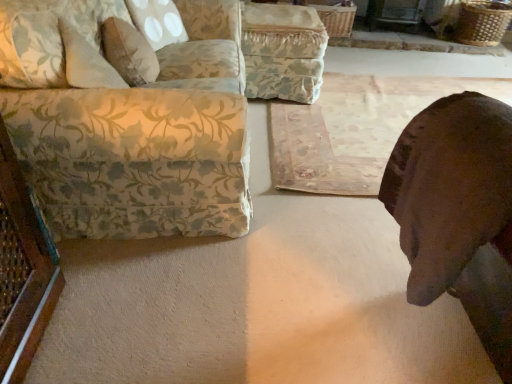
The width and height of the screenshot is (512, 384). Identify the location of brown leather dog at lower right. (451, 189).

Where is `rustic wooden mat at center`? This screenshot has height=384, width=512. rustic wooden mat at center is located at coordinates (355, 129).

What do you see at coordinates (283, 51) in the screenshot?
I see `floral fabric ottoman at center` at bounding box center [283, 51].

This screenshot has width=512, height=384. What do you see at coordinates (128, 117) in the screenshot?
I see `floral fabric couch at left` at bounding box center [128, 117].

Identify the location of brown leather dog at lower right. Image resolution: width=512 pixels, height=384 pixels. (451, 189).

Which object is positioned more to the right, fluffy beige pillow at upper left or floral fabric couch at left?

floral fabric couch at left is more to the right.

Considering the points (106, 48) and (165, 59), which point is behind, point (106, 48) or point (165, 59)?

The point (165, 59) is more distant.

Is fluffy beige pillow at upper left surrounding floral fabric couch at left?

Actually, floral fabric couch at left is outside fluffy beige pillow at upper left.

Could you tell me if fluffy beige pillow at upper left is facing floral fabric couch at left?

Yes, fluffy beige pillow at upper left is aimed at floral fabric couch at left.

Is brown leather dog at lower right looking in the opposite direction of rustic wooden mat at center?

No, brown leather dog at lower right is not facing away from rustic wooden mat at center.

Is brown leather dog at lower right positioned behind rustic wooden mat at center?

No, the depth of brown leather dog at lower right is less than that of rustic wooden mat at center.

Is brown leather dog at lower right next to rustic wooden mat at center?

brown leather dog at lower right and rustic wooden mat at center are clearly separated.

Which object is positioned more to the left, rustic wooden mat at center or floral fabric ottoman at center?

floral fabric ottoman at center.

Is point (370, 149) farther from viewer compared to point (268, 16)?

No, it is not.

From a real-world perspective, who is located higher, rustic wooden mat at center or floral fabric ottoman at center?

floral fabric ottoman at center, from a real-world perspective.

How many degrees apart are the facing directions of rustic wooden mat at center and floral fabric ottoman at center?

The facing directions of rustic wooden mat at center and floral fabric ottoman at center are 91 degrees apart.

Would you say fluffy beige pillow at upper left is outside floral fabric ottoman at center?

Yes, fluffy beige pillow at upper left is located beyond the bounds of floral fabric ottoman at center.

Between fluffy beige pillow at upper left and floral fabric ottoman at center, which one has smaller width?

fluffy beige pillow at upper left.

In terms of height, does fluffy beige pillow at upper left look taller or shorter compared to floral fabric ottoman at center?

Considering their sizes, fluffy beige pillow at upper left has less height than floral fabric ottoman at center.

From the image's perspective, between fluffy beige pillow at upper left and floral fabric ottoman at center, who is located below?

fluffy beige pillow at upper left, from the image's perspective.

Is brown leather dog at lower right positioned with its back to floral fabric couch at left?

That's not correct — brown leather dog at lower right is not looking away from floral fabric couch at left.

Considering the positions of point (509, 225) and point (208, 11), is point (509, 225) closer or farther from the camera than point (208, 11)?

Clearly, point (509, 225) is closer to the camera than point (208, 11).

Is floral fabric couch at left surrounded by brown leather dog at lower right?

No, floral fabric couch at left is not a part of brown leather dog at lower right.

From a real-world perspective, who is located higher, brown leather dog at lower right or floral fabric couch at left?

brown leather dog at lower right.

From a real-world perspective, which object stands above the other?

brown leather dog at lower right.

The width and height of the screenshot is (512, 384). Find the location of `animal in front of the rustic wooden mat at center`. animal in front of the rustic wooden mat at center is located at coordinates 451,189.

Is point (359, 140) closer to camera compared to point (473, 100)?

No, (359, 140) is further to viewer.

Are rustic wooden mat at center and brown leather dog at lower right making contact?

No, rustic wooden mat at center is not next to brown leather dog at lower right.

Looking at this image, can you confirm if floral fabric ottoman at center is shorter than brown leather dog at lower right?

Yes.

Are floral fabric ottoman at center and brown leather dog at lower right far apart?

Absolutely, floral fabric ottoman at center is distant from brown leather dog at lower right.

Where is `studio couch on the right side of fluffy beige pillow at upper left`? Image resolution: width=512 pixels, height=384 pixels. studio couch on the right side of fluffy beige pillow at upper left is located at coordinates (128, 117).

Image resolution: width=512 pixels, height=384 pixels. Find the location of `mat that is under the brown leather dog at lower right (from a real-world perspective)`. mat that is under the brown leather dog at lower right (from a real-world perspective) is located at coordinates [355, 129].

Considering their positions, is fluffy beige pillow at upper left positioned further to rustic wooden mat at center than floral fabric ottoman at center?

The object further to rustic wooden mat at center is fluffy beige pillow at upper left.

Which object lies nearer to the anchor point floral fabric couch at left, brown leather dog at lower right or floral fabric ottoman at center?

brown leather dog at lower right lies closer to floral fabric couch at left than the other object.

Based on their spatial positions, is brown leather dog at lower right or floral fabric couch at left closer to fluffy beige pillow at upper left?

floral fabric couch at left is positioned closer to the anchor fluffy beige pillow at upper left.

From the image, which object appears to be nearer to brown leather dog at lower right, floral fabric ottoman at center or floral fabric couch at left?

floral fabric couch at left is positioned closer to the anchor brown leather dog at lower right.

From the image, which object appears to be farther from rustic wooden mat at center, floral fabric ottoman at center or floral fabric couch at left?

floral fabric couch at left is further to rustic wooden mat at center.

Estimate the real-world distances between objects in this image. Which object is closer to floral fabric ottoman at center, brown leather dog at lower right or floral fabric couch at left?

floral fabric couch at left.

Considering their positions, is rustic wooden mat at center positioned closer to floral fabric ottoman at center than floral fabric couch at left?

rustic wooden mat at center lies closer to floral fabric ottoman at center than the other object.

Looking at the image, which one is located further to brown leather dog at lower right, floral fabric couch at left or fluffy beige pillow at upper left?

The object further to brown leather dog at lower right is fluffy beige pillow at upper left.

This screenshot has width=512, height=384. I want to click on swivel chair between floral fabric couch at left and rustic wooden mat at center, so click(283, 51).

This screenshot has height=384, width=512. Find the location of `animal between floral fabric couch at left and rustic wooden mat at center from left to right`. animal between floral fabric couch at left and rustic wooden mat at center from left to right is located at coordinates (451, 189).

Locate an element on the screen. Image resolution: width=512 pixels, height=384 pixels. studio couch located between fluffy beige pillow at upper left and rustic wooden mat at center in the left-right direction is located at coordinates (128, 117).

Where is `pillow located between brown leather dog at lower right and floral fabric ottoman at center in the depth direction`? The image size is (512, 384). pillow located between brown leather dog at lower right and floral fabric ottoman at center in the depth direction is located at coordinates (129, 52).